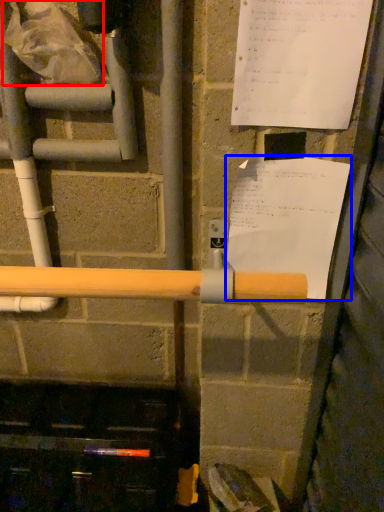
Question: Which of the following is the farthest to the observer, plastic bag (highlighted by a red box) or paper (highlighted by a blue box)?

Choices:
 (A) plastic bag
 (B) paper

Answer: (A)